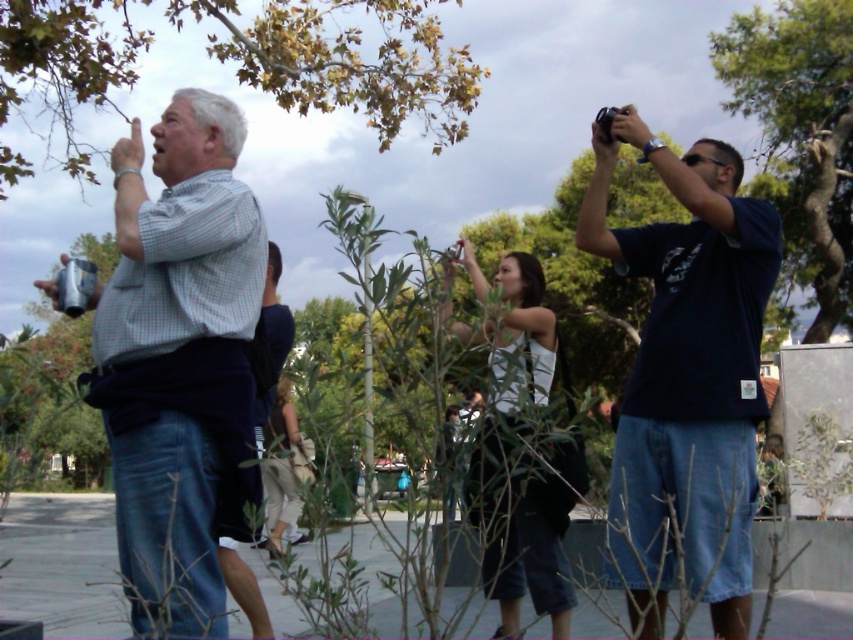
Question: Which is nearer to the white matte tank top at center?

Choices:
 (A) dark blue t-shirt at upper right
 (B) khaki fabric pants at center

Answer: (A)

Question: Among these points, which one is farthest from the camera?

Choices:
 (A) (305, 10)
 (B) (820, 188)
 (C) (625, 502)
 (D) (473, 488)

Answer: (B)

Question: Can you confirm if white matte tank top at center is positioned above green leafy tree at upper right?

Choices:
 (A) no
 (B) yes

Answer: (B)

Question: Among these points, which one is farthest from the camera?

Choices:
 (A) (558, 580)
 (B) (711, 433)
 (C) (294, 481)

Answer: (C)

Question: Does green leafy tree at upper right have a greater width compared to khaki fabric pants at center?

Choices:
 (A) no
 (B) yes

Answer: (A)

Question: Is checkered fabric shirt at left to the left of khaki fabric pants at center from the viewer's perspective?

Choices:
 (A) yes
 (B) no

Answer: (B)